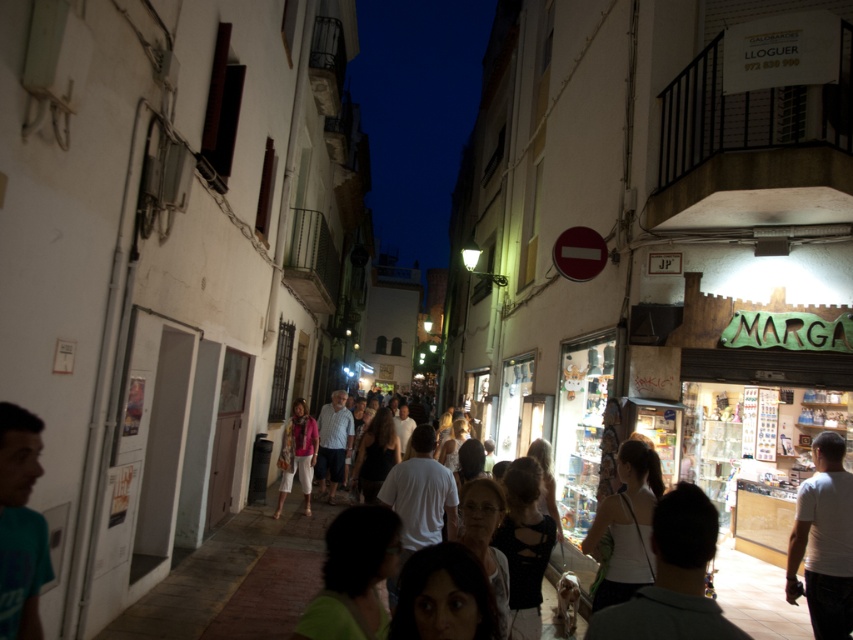
You are a tourist standing on the street and want to buy a souvenir. You see the white matte shirt at right and the matte pink sweater at center. Which one is closer to you?

The white matte shirt at right is 28.51 feet away from the matte pink sweater at center. Since the question asks which is closer to you, but the description only provides the distance between the two items, not their individual distances from the observer, we cannot determine which is closer based on the given information.

You are standing at the center of the street and want to buy a souvenir. There is a white matte shirt at right. Can you see it from your current position?

Yes, the white matte shirt at right is located at position [824,540], which is within your field of view from the center of the street.